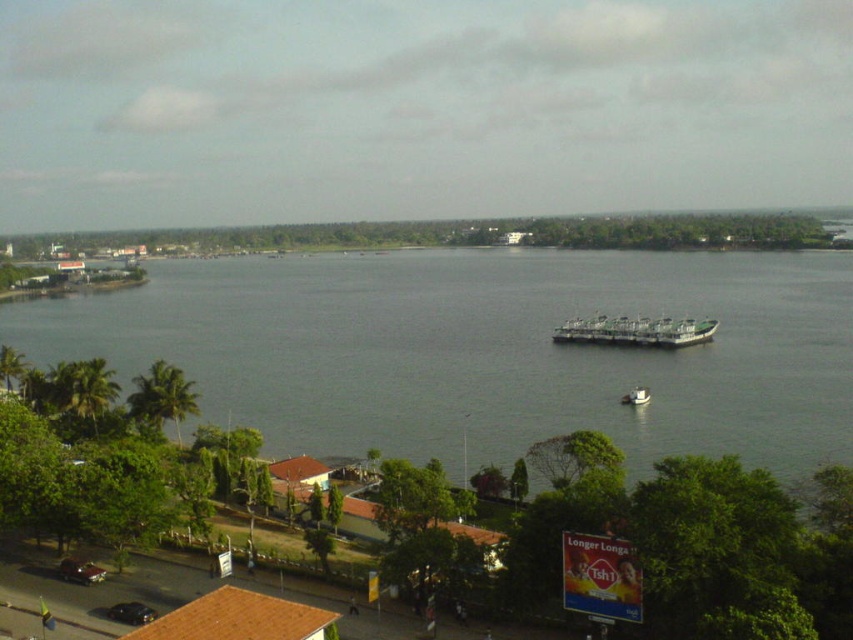
You are a boat operator who needs to navigate through the gray water at center and the green matte barge at center. Based on their widths, which one can you pass through more easily?

The gray water at center has a larger width than the green matte barge at center, so you can pass through the gray water at center more easily.

You are standing at the point marked by the coordinates point [485,349]. What do you see around you?

You are standing at point [485,349], which is located on the gray water at center. The surrounding area includes the waterfront with vehicles and pedestrians on the road in the foreground, small buildings with red roofs, and a billboard on the right. The large body of water stretches ahead with boats, and distant landmasses with trees and structures can be seen in the background.

You are standing at the point with coordinates point (x=622, y=401) and want to walk to the point with coordinates point (x=367, y=356). Which direction should you move in to reach your destination?

Since point (x=367, y=356) is behind point (x=622, y=401), you should move backward to reach it.